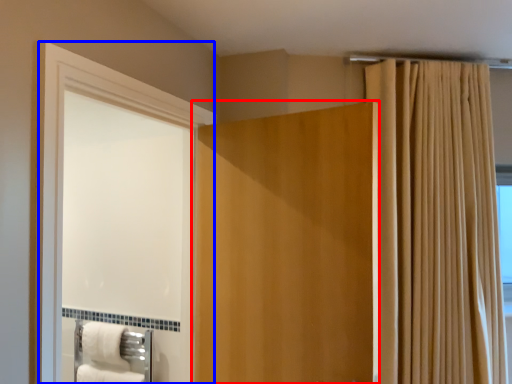
Question: Which point is further to the camera, door (highlighted by a red box) or screen door (highlighted by a blue box)?

Choices:
 (A) door
 (B) screen door

Answer: (A)